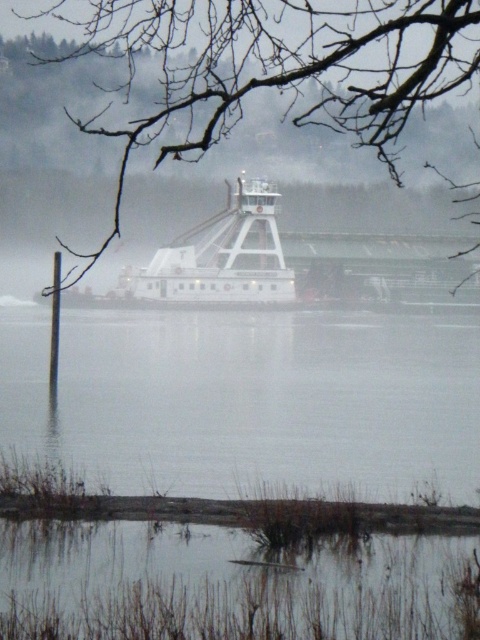
Does clear water at lower center have a larger size compared to bare branches at upper center?

Actually, clear water at lower center might be smaller than bare branches at upper center.

Is point (256, 364) in front of point (210, 49)?

That is True.

This screenshot has height=640, width=480. What do you see at coordinates (249, 401) in the screenshot?
I see `clear water at lower center` at bounding box center [249, 401].

This screenshot has height=640, width=480. In order to click on clear water at lower center in this screenshot , I will do `click(249, 401)`.